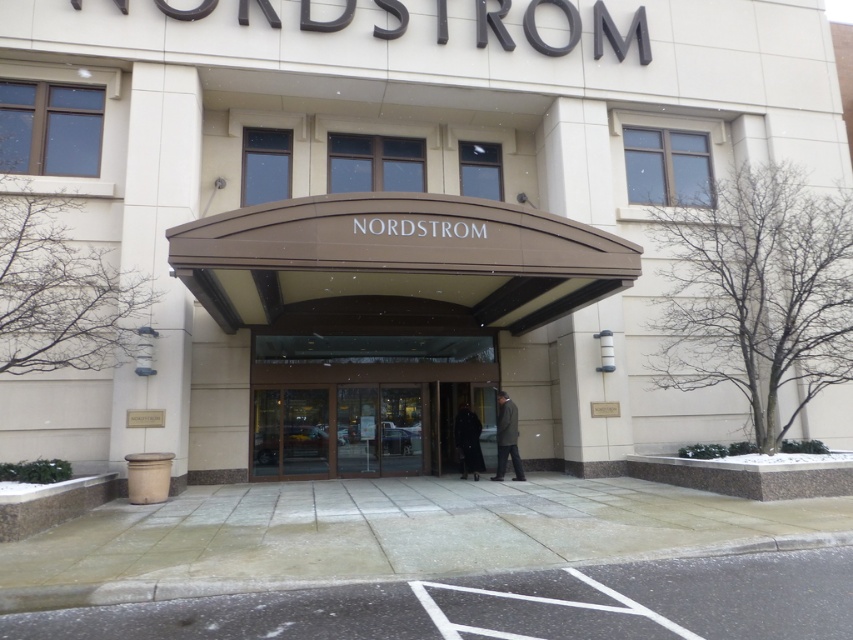
Question: Observing the image, what is the correct spatial positioning of brown polished wood awning at center in reference to dark gray suit at center?

Choices:
 (A) below
 (B) above

Answer: (B)

Question: Which point is closer to the camera?

Choices:
 (A) (498, 413)
 (B) (474, 465)

Answer: (A)

Question: Among these points, which one is farthest from the camera?

Choices:
 (A) (498, 461)
 (B) (482, 406)
 (C) (337, 406)

Answer: (B)

Question: Which point is farther to the camera?

Choices:
 (A) dark gray suit at center
 (B) transparent glass doors at center
 (C) black leather coat at center
 (D) dark wool coat at center

Answer: (C)

Question: Is black leather coat at center thinner than dark gray suit at center?

Choices:
 (A) no
 (B) yes

Answer: (A)

Question: From the image, what is the correct spatial relationship of brown polished wood awning at center in relation to black leather coat at center?

Choices:
 (A) left
 (B) right

Answer: (A)